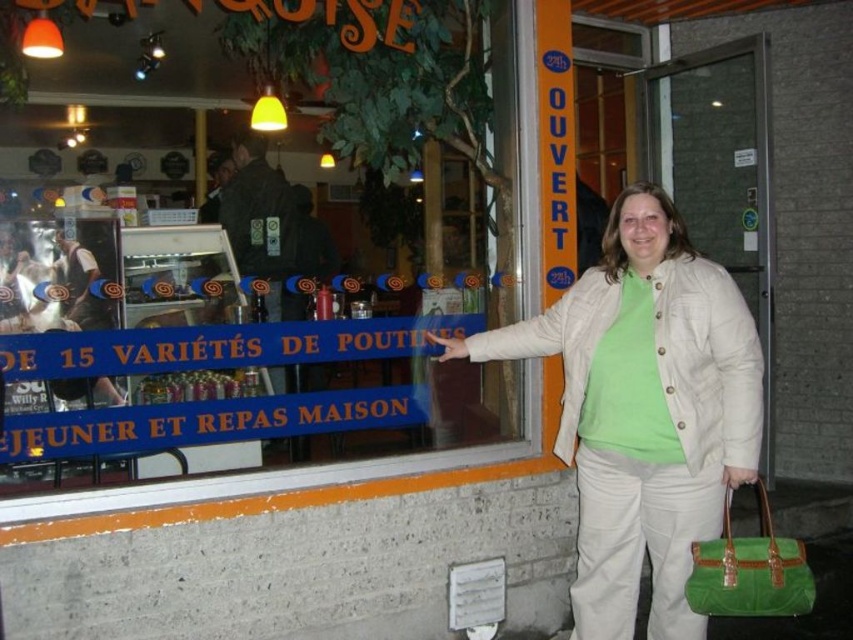
Does point (683, 417) come farther from viewer compared to point (753, 362)?

Yes, point (683, 417) is behind point (753, 362).

Consider the image. Is light beige quilted jacket at center wider than white quilted jacket at center?

Correct, the width of light beige quilted jacket at center exceeds that of white quilted jacket at center.

Who is more forward, (634, 284) or (691, 387)?

Point (691, 387) is more forward.

Locate an element on the screen. The image size is (853, 640). light beige quilted jacket at center is located at coordinates (643, 410).

Is white quilted jacket at center bigger than green fabric handbag at lower right?

Correct, white quilted jacket at center is larger in size than green fabric handbag at lower right.

Does white quilted jacket at center have a lesser width compared to green fabric handbag at lower right?

No.

Between point (686, 380) and point (778, 576), which one is positioned in front?

Point (778, 576)

Locate an element on the screen. The width and height of the screenshot is (853, 640). white quilted jacket at center is located at coordinates (708, 364).

Does light beige quilted jacket at center have a lesser width compared to green fabric handbag at lower right?

Incorrect, light beige quilted jacket at center's width is not less than green fabric handbag at lower right's.

Does point (614, 454) come closer to viewer compared to point (758, 573)?

No, it is behind (758, 573).

At what (x,y) coordinates should I click in order to perform the action: click on light beige quilted jacket at center. Please return your answer as a coordinate pair (x, y). Looking at the image, I should click on (643, 410).